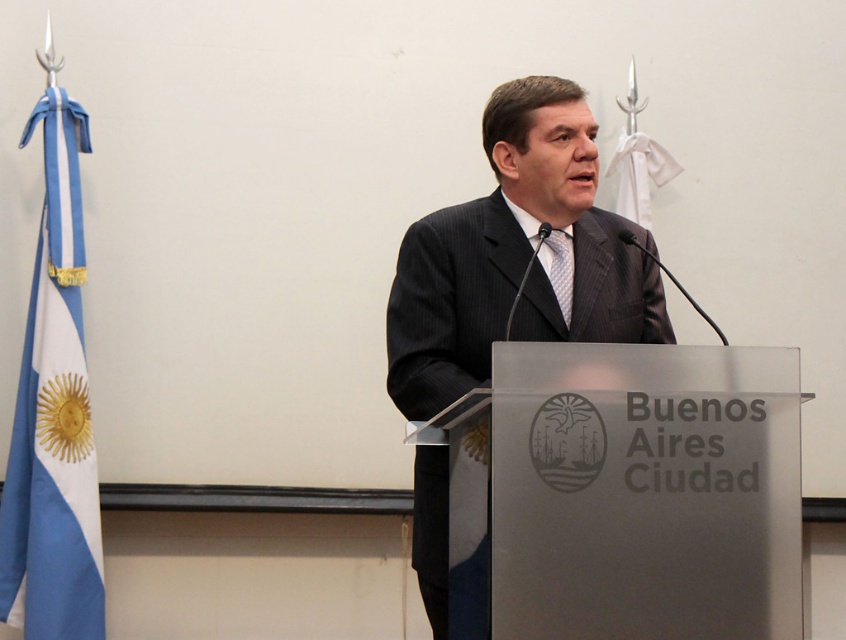
You are an event organizer who needs to ensure that the speaker is properly dressed for the event. Based on the image, does the dark gray suit at center and the blue dotted tie at center meet the formal dress code requirements?

The dark gray suit at center has a greater height compared to blue dotted tie at center, which is appropriate for formal attire as the suit should be the focal point.

You are an event organizer who needs to arrange a photo shoot for the speaker. Since the dark gray suit at center and the blue dotted tie at center are important elements, where should you position the lighting to highlight both items effectively?

The dark gray suit at center is positioned on the left side of blue dotted tie at center. To highlight both effectively, position the lighting so it illuminates the left side of the dark gray suit at center and the right side of the blue dotted tie at center, ensuring both elements are well lit.